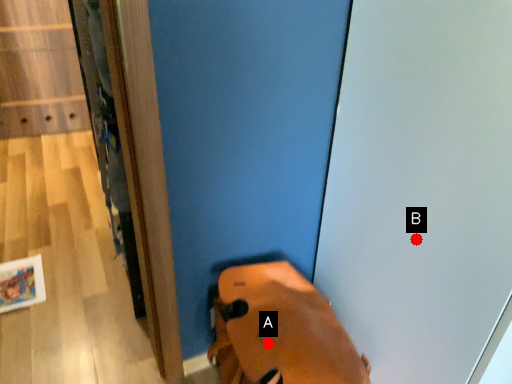
Question: Two points are circled on the image, labeled by A and B beside each circle. Which point appears closest to the camera in this image?

Choices:
 (A) A is closer
 (B) B is closer

Answer: (B)